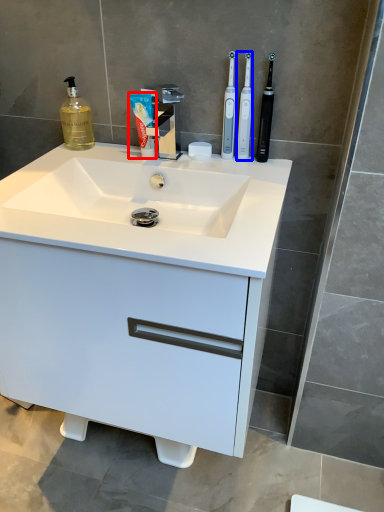
Question: Which of the following is the farthest to the observer, toothpaste (highlighted by a red box) or toothbrush (highlighted by a blue box)?

Choices:
 (A) toothpaste
 (B) toothbrush

Answer: (A)